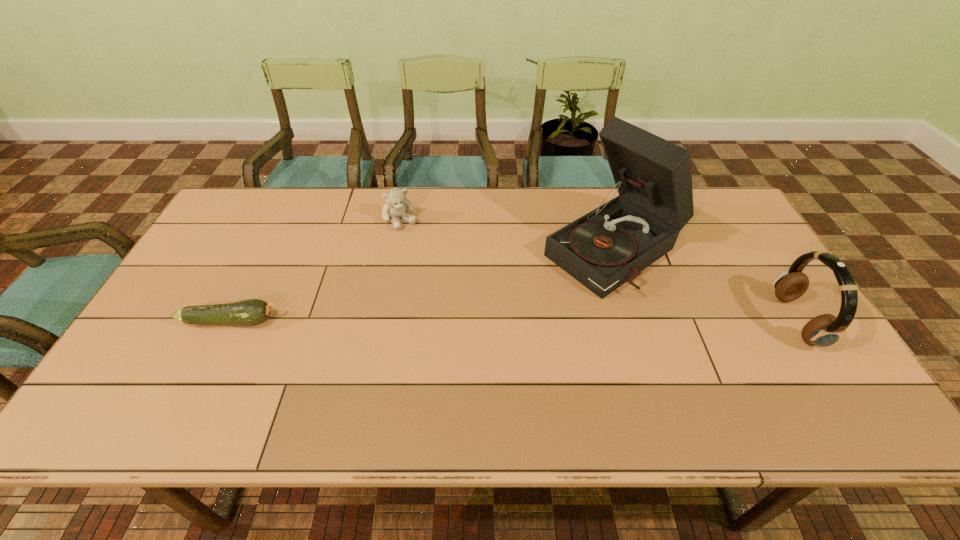
Locate an element on the screen. blank space located on the ear cup of the third shortest object is located at coordinates (701, 321).

Image resolution: width=960 pixels, height=540 pixels. In order to click on free region located 0.190m on the ear cup of the third shortest object in this screenshot , I will do `click(708, 321)`.

Where is `free space located 0.140m on the front-facing side of the third object from left to right`? The image size is (960, 540). free space located 0.140m on the front-facing side of the third object from left to right is located at coordinates (528, 304).

Locate an element on the screen. The width and height of the screenshot is (960, 540). vacant space located on the front-facing side of the third object from left to right is located at coordinates (452, 353).

This screenshot has height=540, width=960. I want to click on free space located 0.350m on the front-facing side of the third object from left to right, so click(466, 344).

Image resolution: width=960 pixels, height=540 pixels. I want to click on free spot located 0.260m on the face of the teddy bear, so click(443, 284).

Find the location of `vacant position located on the face of the teddy bear`. vacant position located on the face of the teddy bear is located at coordinates (431, 267).

Locate an element on the screen. vacant space located on the face of the teddy bear is located at coordinates (418, 246).

Identify the location of phonograph_record present at the far edge. (609, 246).

This screenshot has width=960, height=540. I want to click on teddy bear located at the far edge, so click(396, 206).